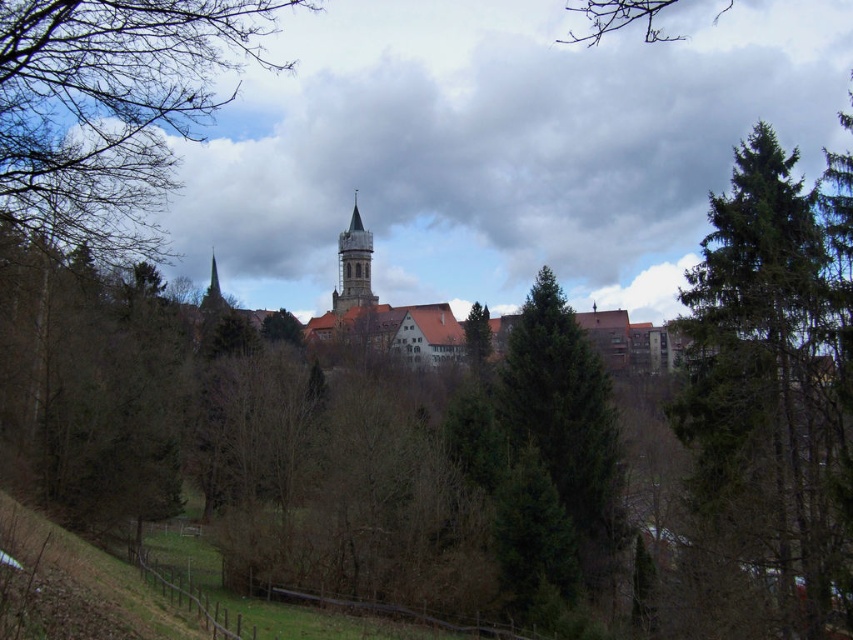
You are standing in the forest looking at the historic town. Which object is closer to you, the brown leafless branches at upper left or the smooth gray stone tower at center?

The brown leafless branches at upper left is closer to the viewer than the smooth gray stone tower at center.

You are standing in front of the wooden fence in the scenic view of the historic town. You notice two points marked in the image. The first point is at coordinate point (666, 36) and the second is at point (358, 280). Which point is closer to your position?

Point (666, 36) is closer to your position because it is further to the viewer than point (358, 280).